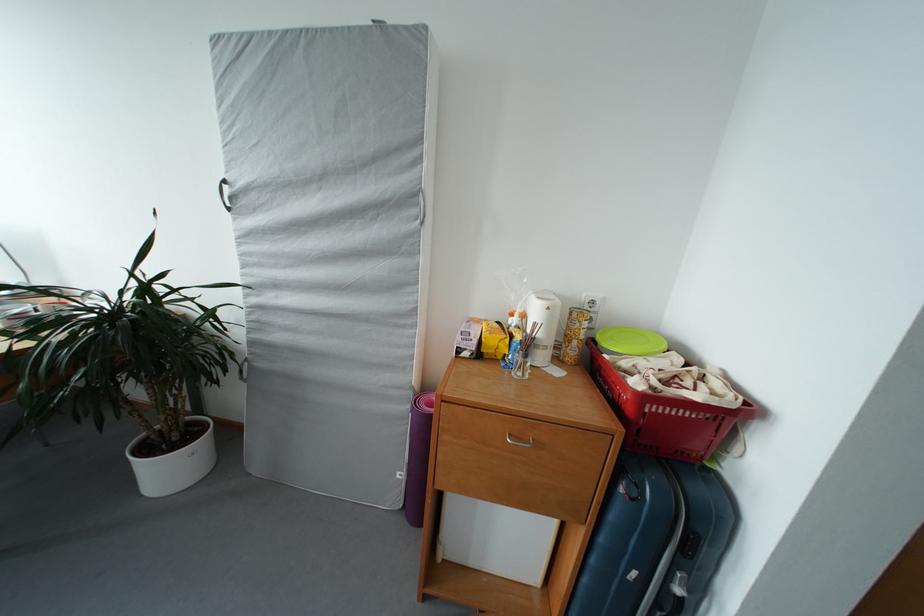
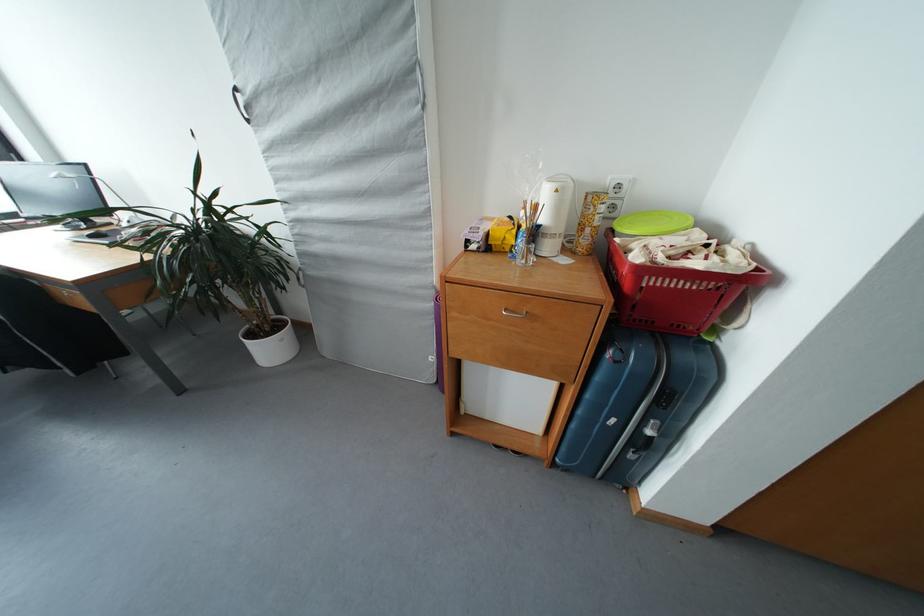
Find the pixel in the second image that matches (516,440) in the first image.

(513, 314)